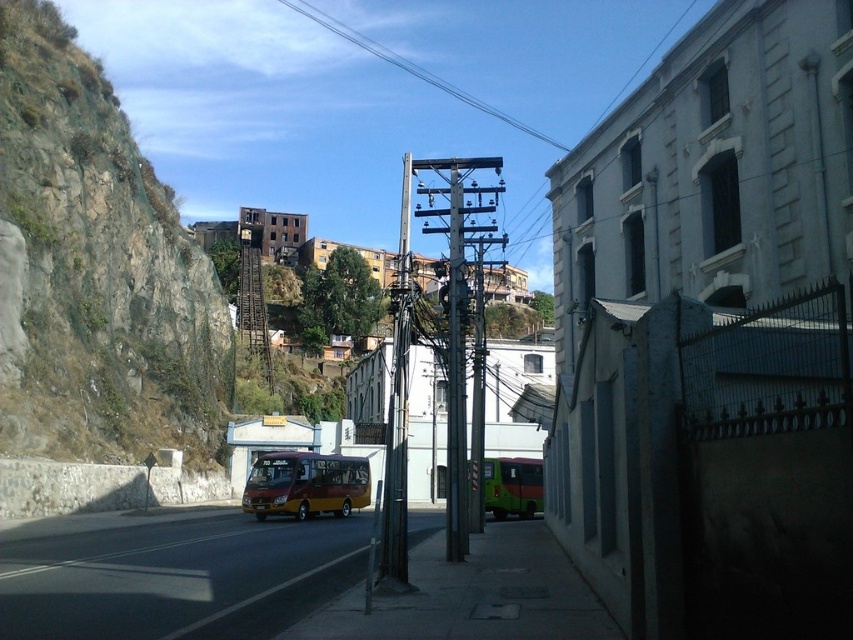
Can you confirm if concrete sidewalk at center is positioned above metallic gray telegraph pole at center?

No.

Who is lower down, concrete sidewalk at center or metallic gray telegraph pole at center?

Positioned lower is concrete sidewalk at center.

Which is behind, point (584, 612) or point (450, 189)?

The point (450, 189) is more distant.

Locate an element on the screen. concrete sidewalk at center is located at coordinates (474, 595).

Does concrete sidewalk at center appear under green matte school bus at lower right?

Actually, concrete sidewalk at center is above green matte school bus at lower right.

Which is more to the right, concrete sidewalk at center or green matte school bus at lower right?

Positioned to the right is green matte school bus at lower right.

Between point (512, 616) and point (517, 512), which one is positioned behind?

Point (517, 512)

Where is `concrete sidewalk at center`? The image size is (853, 640). concrete sidewalk at center is located at coordinates (474, 595).

Can you confirm if concrete sidewalk at center is wider than maroon matte bus at center?

No, concrete sidewalk at center is not wider than maroon matte bus at center.

Is concrete sidewalk at center further to the viewer compared to maroon matte bus at center?

No, it is in front of maroon matte bus at center.

Who is more forward, (442,595) or (271,509)?

Point (442,595) is more forward.

At what (x,y) coordinates should I click in order to perform the action: click on concrete sidewalk at center. Please return your answer as a coordinate pair (x, y). The height and width of the screenshot is (640, 853). Looking at the image, I should click on (474, 595).